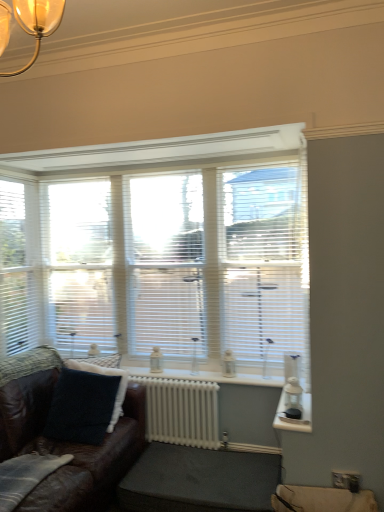
Locate an element on the screen. This screenshot has height=512, width=384. free point above transparent plastic glass door at center (from a real-world perspective) is located at coordinates (171, 168).